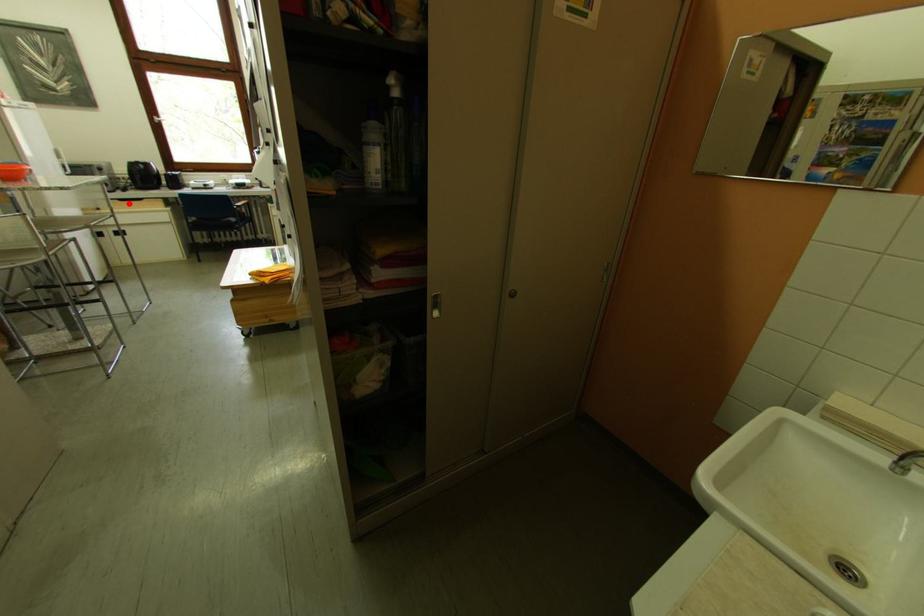
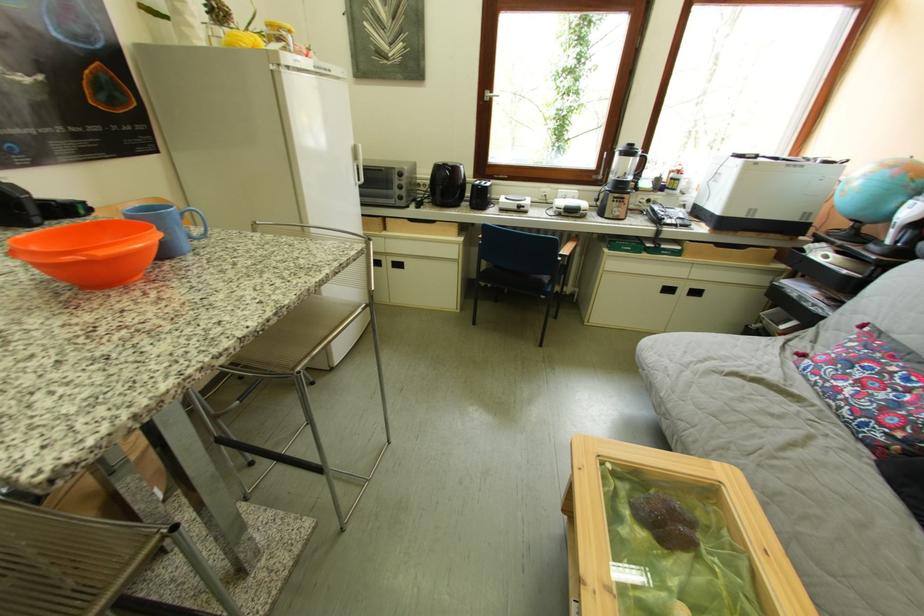
Question: I am providing you with two images of the same scene from different viewpoints. Image1 has a red point marked. In image2, the corresponding 3D location appears at what relative position? Reply with the corresponding letter.

Choices:
 (A) Closer
 (B) Farther

Answer: (A)